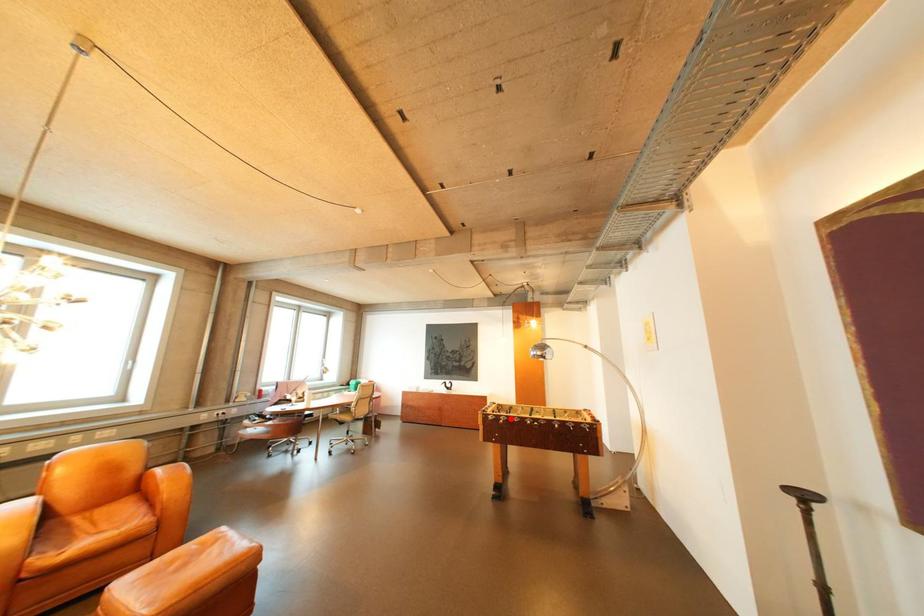
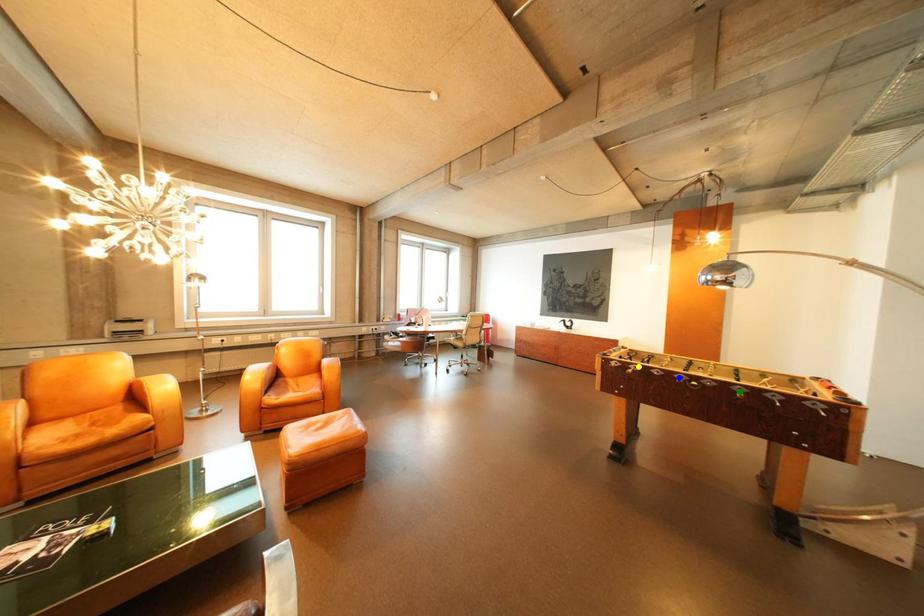
Question: I am providing you with two images of the same scene from different viewpoints. A red point is marked on the first image. You are given multiple points on the second image. Which point in image 2 is actually the same real-world point as the red point in image 1?

Choices:
 (A) green point
 (B) yellow point
 (C) blue point

Answer: (B)